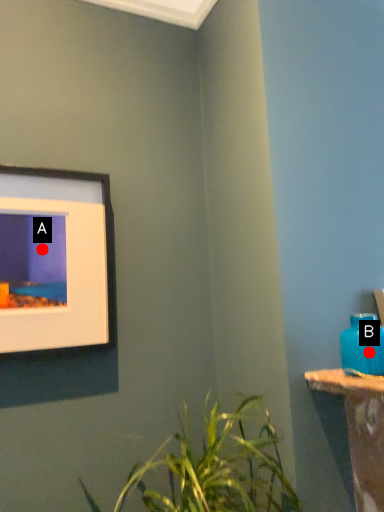
Question: Two points are circled on the image, labeled by A and B beside each circle. Among these points, which one is farthest from the camera?

Choices:
 (A) A is further
 (B) B is further

Answer: (A)